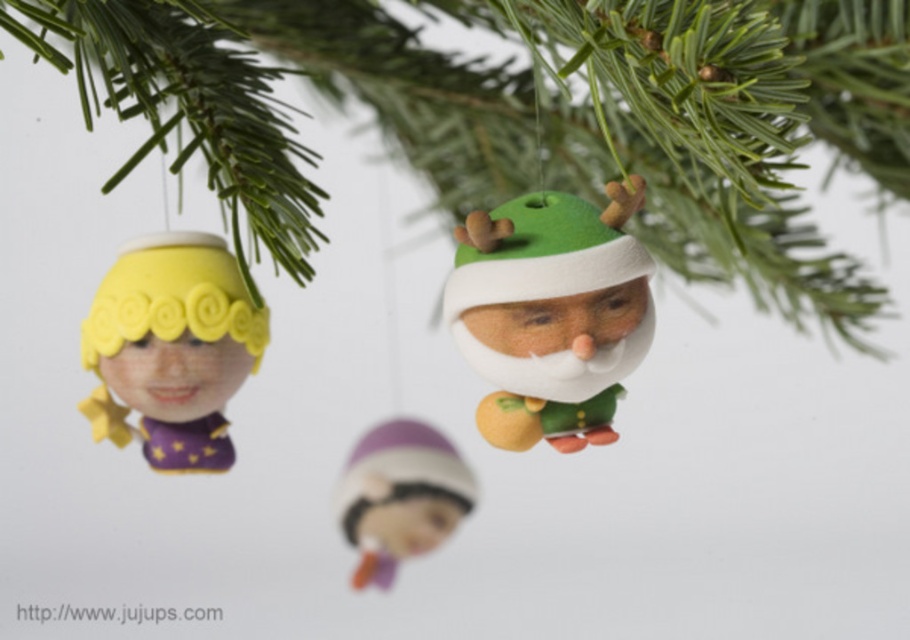
You are standing 30 inches away from the green felt santa at center. Can you reach it without moving closer?

The distance between the green felt santa at center and the viewer is 33.62 inches. Since you are currently 30 inches away, you are already closer than the stated distance, so you can reach it without needing to move closer.

You are standing 5 feet away from the Christmas tree. Can you see the point at coordinates (844, 138) clearly?

The distance of point (844, 138) from viewer is 4.03 feet, so yes, you can see it clearly since you are standing 5 feet away from the Christmas tree.